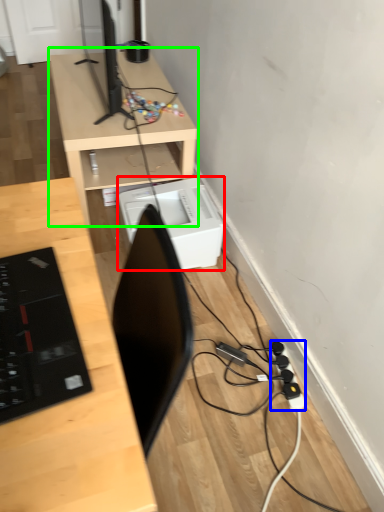
Question: Which is nearer to the printer (highlighted by a red box)? extension cord (highlighted by a blue box) or desk (highlighted by a green box).

Choices:
 (A) extension cord
 (B) desk

Answer: (B)